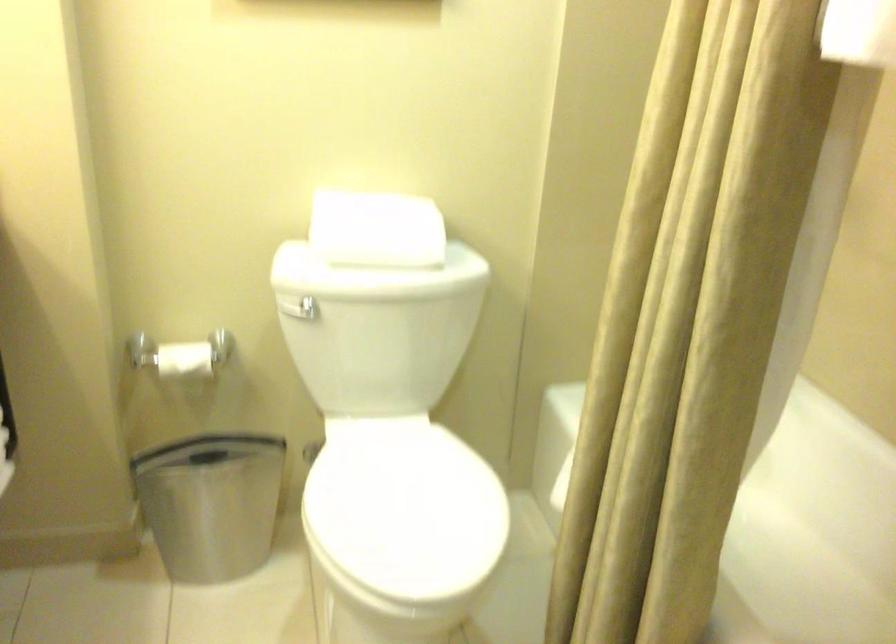
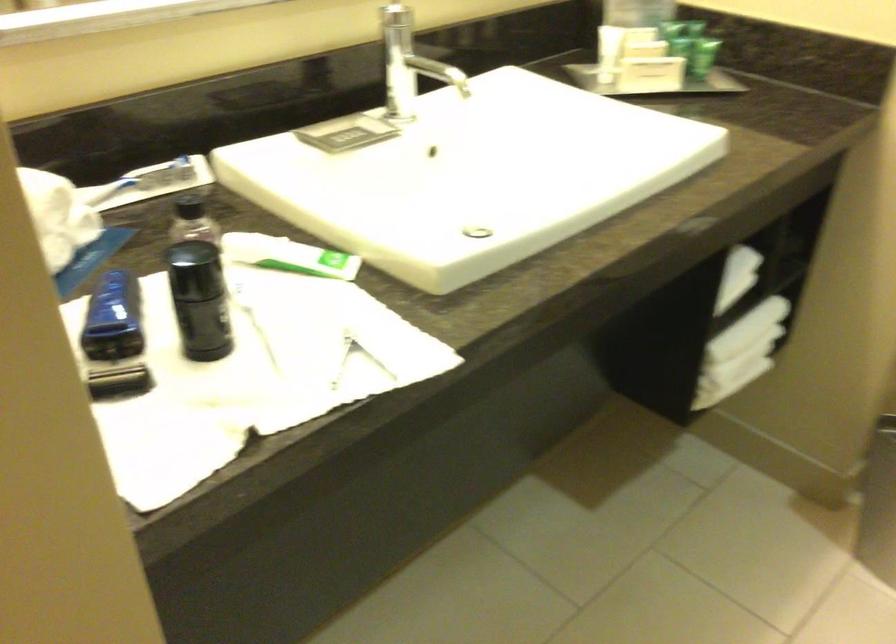
Based on the photo, how did the camera likely rotate?

The rotation direction of the camera is left-down.